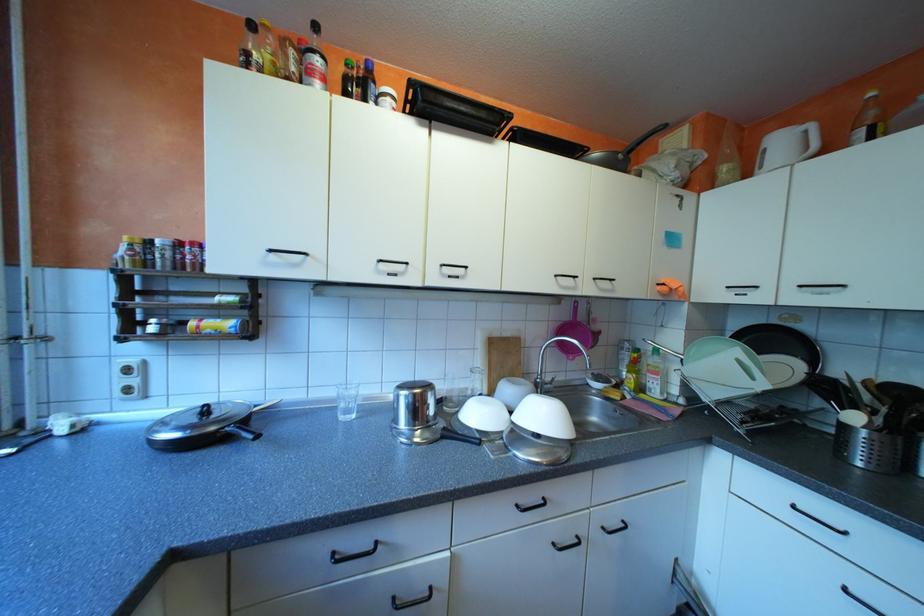
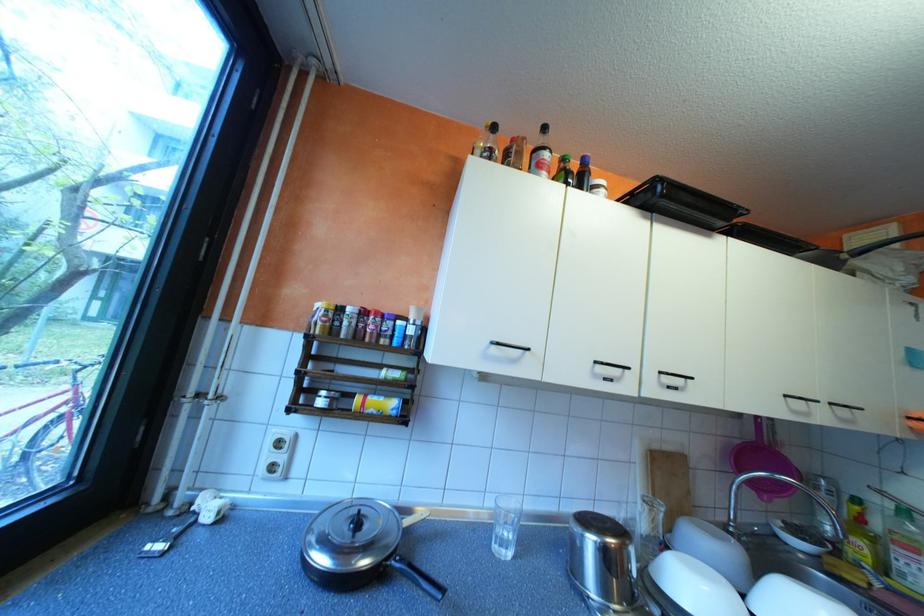
Where in the second image is the point corresponding to the point at 523,129 from the first image?

(745, 224)